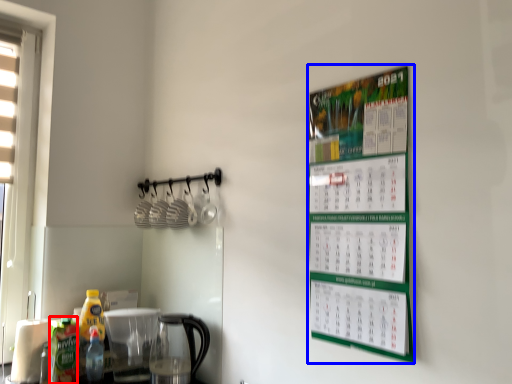
Question: Which object is further to the camera taking this photo, bottle (highlighted by a red box) or bulletin board (highlighted by a blue box)?

Choices:
 (A) bottle
 (B) bulletin board

Answer: (A)